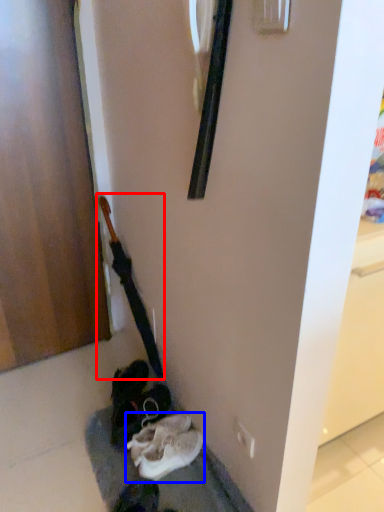
Question: Which object appears closest to the camera in this image, guitar (highlighted by a red box) or footwear (highlighted by a blue box)?

Choices:
 (A) guitar
 (B) footwear

Answer: (B)